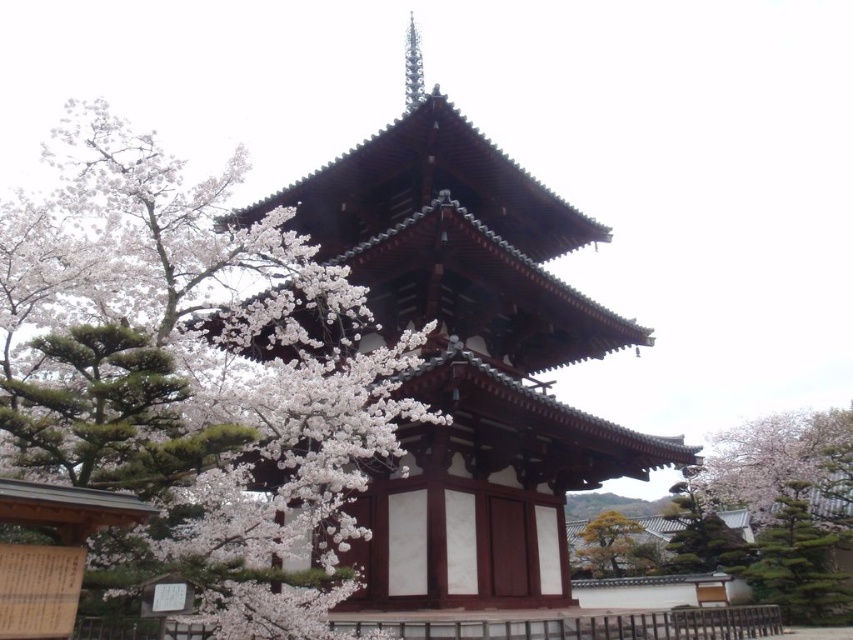
Which is behind, point (808, 557) or point (675, 518)?

The point (675, 518) is more distant.

Does point (834, 531) come farther from viewer compared to point (729, 570)?

Yes.

Image resolution: width=853 pixels, height=640 pixels. I want to click on green textured pine tree at right, so click(799, 563).

Where is `green textured tree at lower right`? The height and width of the screenshot is (640, 853). green textured tree at lower right is located at coordinates (701, 538).

Which of these two, white blossoms at center or green textured tree at lower right, stands taller?

green textured tree at lower right is taller.

Which is above, white blossoms at center or green textured tree at lower right?

white blossoms at center

I want to click on white blossoms at center, so click(178, 397).